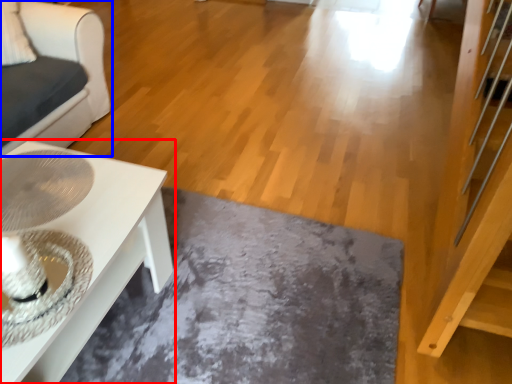
Question: Which point is further to the camera, table (highlighted by a red box) or furniture (highlighted by a blue box)?

Choices:
 (A) table
 (B) furniture

Answer: (B)